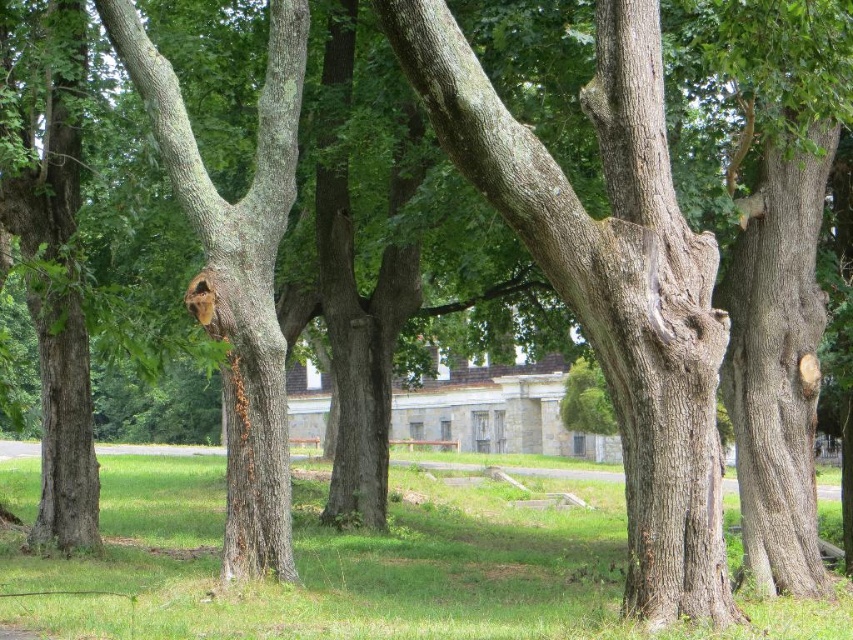
Between point (228, 600) and point (265, 342), which one is positioned in front?

Positioned in front is point (228, 600).

Who is positioned more to the right, green grass at center or smooth bark tree at center?

green grass at center

Does point (454, 534) lie in front of point (158, 52)?

That is False.

Where is `green grass at center`? green grass at center is located at coordinates (360, 570).